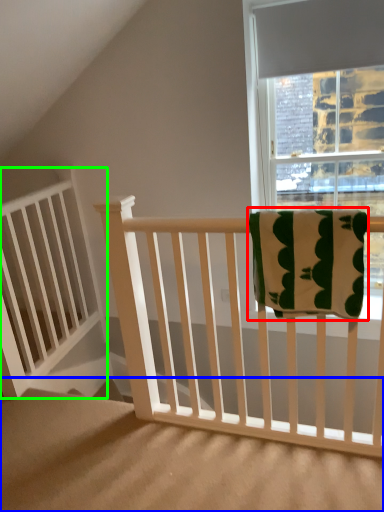
Question: Considering the real-world distances, which object is closest to beach towel (highlighted by a red box)? stairs (highlighted by a blue box) or balustrade (highlighted by a green box).

Choices:
 (A) stairs
 (B) balustrade

Answer: (A)